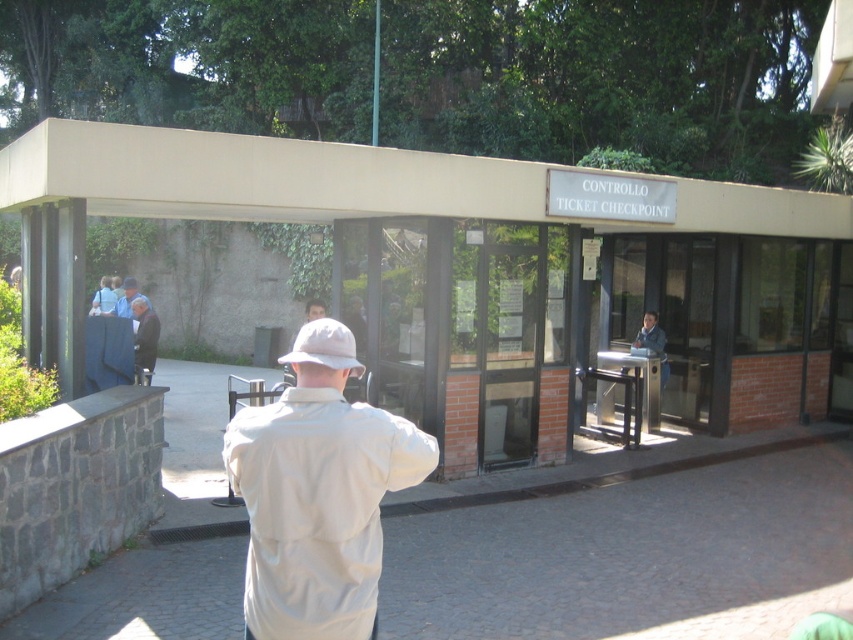
Between light brown leather jacket at center and blue fabric jacket at center, which one appears on the right side from the viewer's perspective?

light brown leather jacket at center

The height and width of the screenshot is (640, 853). Describe the element at coordinates (650, 336) in the screenshot. I see `light brown leather jacket at center` at that location.

Measure the distance between point [660,332] and camera.

Point [660,332] and camera are 11.71 meters apart.

Locate an element on the screen. light brown leather jacket at center is located at coordinates (650, 336).

Between beige fabric jacket at center and dark blue jacket at center, which one has more height?

Standing taller between the two is dark blue jacket at center.

Can you confirm if beige fabric jacket at center is positioned to the right of dark blue jacket at center?

Correct, you'll find beige fabric jacket at center to the right of dark blue jacket at center.

Which is in front, point (338, 429) or point (146, 371)?

Positioned in front is point (338, 429).

Locate an element on the screen. Image resolution: width=853 pixels, height=640 pixels. beige fabric jacket at center is located at coordinates coord(318,493).

Who is more forward, (363, 416) or (115, 307)?

Point (363, 416) is more forward.

Who is shorter, beige fabric jacket at center or blue fabric jacket at center?

With less height is blue fabric jacket at center.

Locate an element on the screen. beige fabric jacket at center is located at coordinates (318, 493).